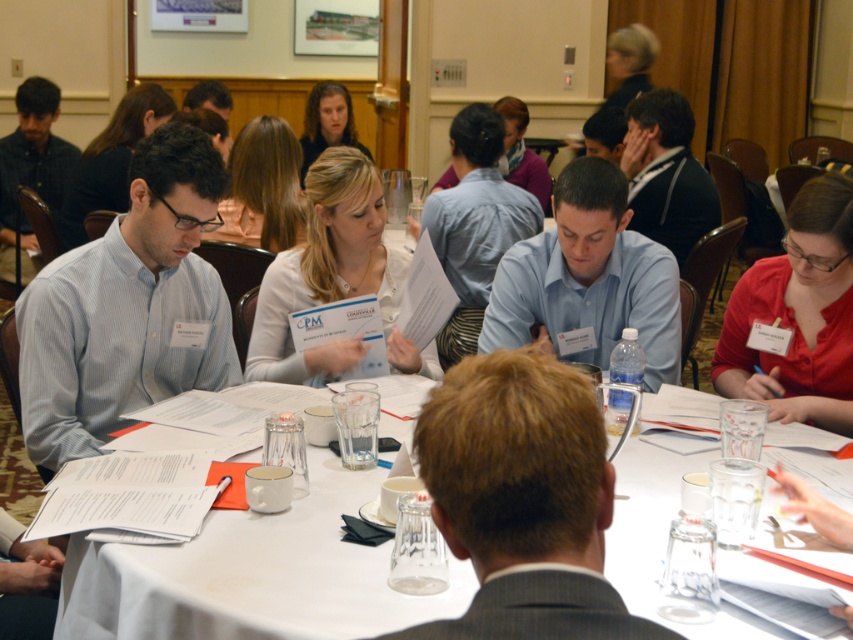
Which is in front, point (473, 579) or point (473, 486)?

Point (473, 486) is more forward.

Can you confirm if white paper at center is smaller than brown hair at center?

Incorrect, white paper at center is not smaller in size than brown hair at center.

Where is `white paper at center`? Image resolution: width=853 pixels, height=640 pixels. white paper at center is located at coordinates (251, 576).

Who is positioned more to the left, light blue shirt at center or matte black shirt at left?

From the viewer's perspective, matte black shirt at left appears more on the left side.

Is light blue shirt at center below matte black shirt at left?

Correct, light blue shirt at center is located below matte black shirt at left.

Locate an element on the screen. Image resolution: width=853 pixels, height=640 pixels. light blue shirt at center is located at coordinates (589, 280).

Identify the location of light blue shirt at center. (589, 280).

Is matte black shirt at center thinner than matte black shirt at left?

Yes, matte black shirt at center is thinner than matte black shirt at left.

From the picture: Is matte black shirt at center taller than matte black shirt at left?

No.

Is point (704, 180) in front of point (20, 108)?

Yes, point (704, 180) is in front of point (20, 108).

Where is `matte black shirt at center`? matte black shirt at center is located at coordinates (666, 173).